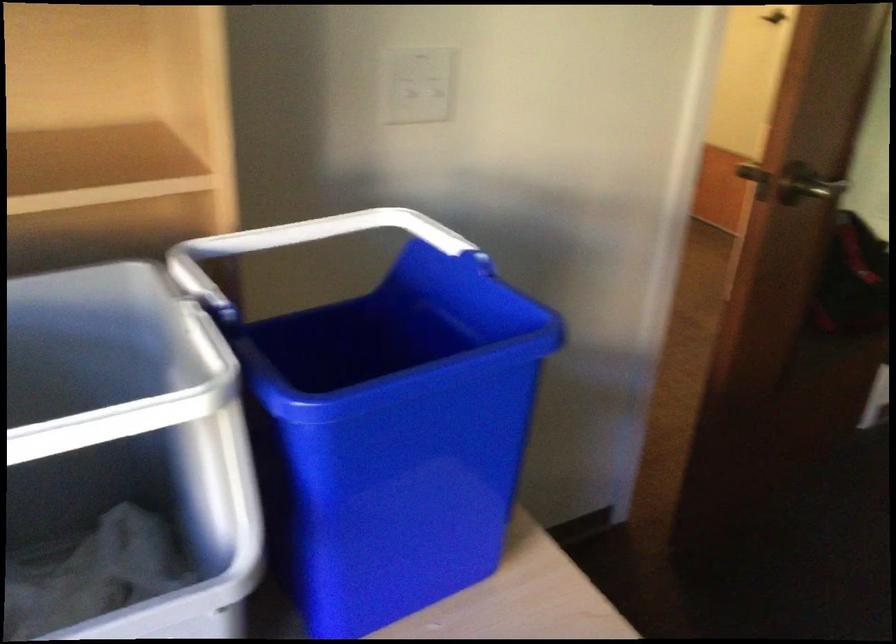
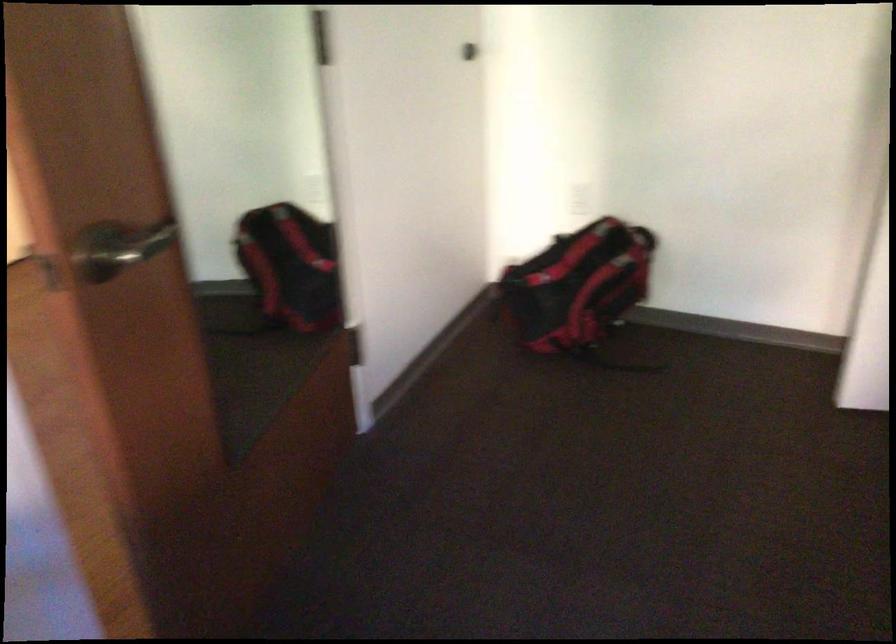
Question: Based on the continuous images, in which direction is the camera rotating? Reply with the corresponding letter.

Choices:
 (A) Left
 (B) Right
 (C) Up
 (D) Down

Answer: (B)